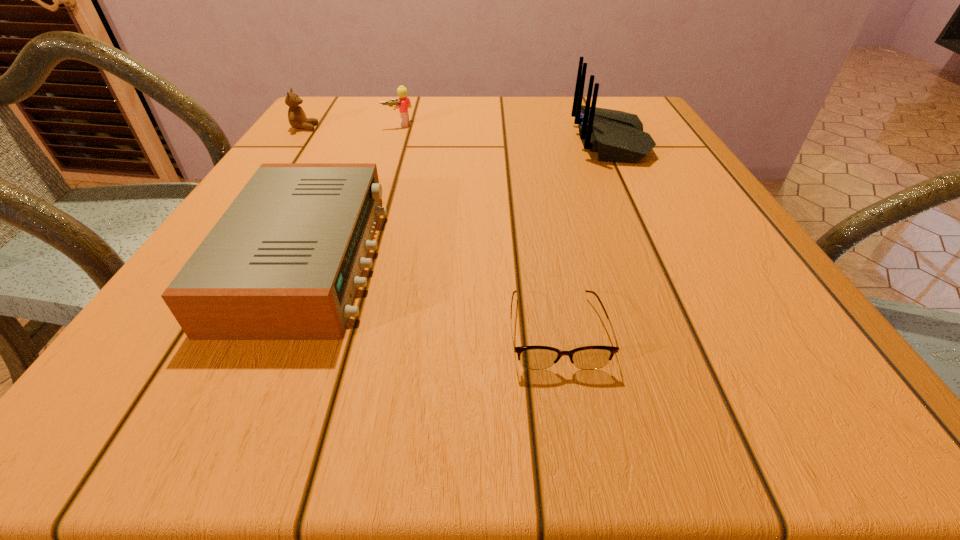
Where is `vacant space that is in between the tallest object and the teddy bear`? vacant space that is in between the tallest object and the teddy bear is located at coordinates (458, 134).

Where is `blank region between the shortest object and the router`? blank region between the shortest object and the router is located at coordinates (583, 236).

Find the location of a particular element. This screenshot has width=960, height=540. vacant space in between the Lego and the leftmost object is located at coordinates (351, 126).

The image size is (960, 540). I want to click on free space that is in between the tallest object and the second object from right to left, so click(x=583, y=236).

The image size is (960, 540). In order to click on unoccupied area between the Lego and the spectacles in this screenshot , I will do `click(477, 227)`.

Locate an element on the screen. free spot between the teddy bear and the fourth object from left to right is located at coordinates (430, 229).

I want to click on vacant space in between the router and the shortest object, so click(583, 236).

This screenshot has height=540, width=960. Find the location of `free space between the second object from right to left and the Lego`. free space between the second object from right to left and the Lego is located at coordinates (477, 227).

Choose which object is the third nearest neighbor to the radio receiver. Please provide its 2D coordinates. Your answer should be formatted as a tuple, i.e. [(x, y)], where the tuple contains the x and y coordinates of a point satisfying the conditions above.

[(404, 103)]

Find the location of a particular element. This screenshot has height=540, width=960. object that stands as the closest to the Lego is located at coordinates (297, 118).